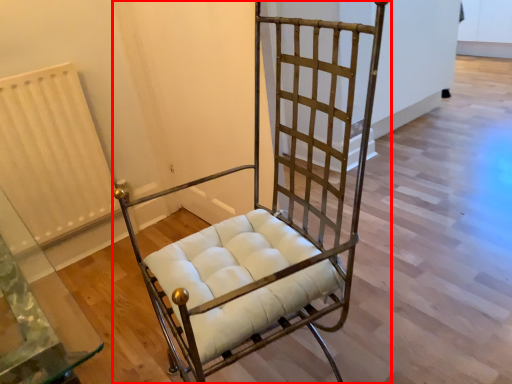
Question: From the image's perspective, where is furniture (annotated by the red box) located relative to radiator?

Choices:
 (A) below
 (B) above

Answer: (A)